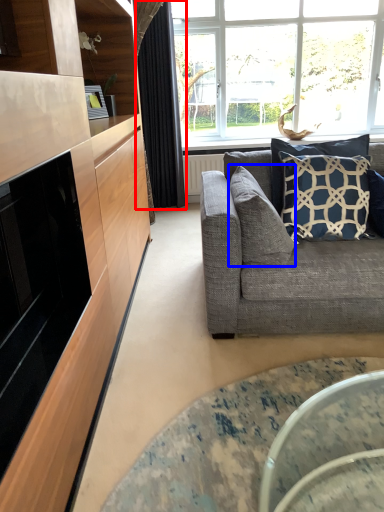
Question: Among these objects, which one is nearest to the camera, curtain (highlighted by a red box) or pillow (highlighted by a blue box)?

Choices:
 (A) curtain
 (B) pillow

Answer: (B)